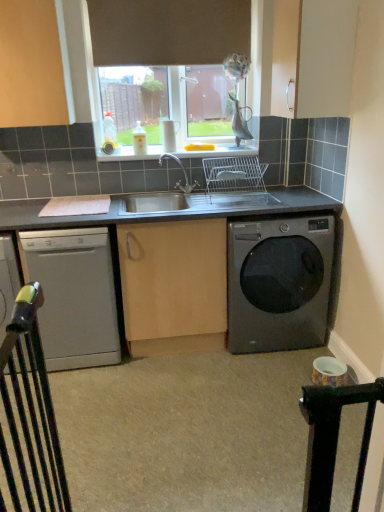
Question: Are satin silver dishwasher at lower left and metallic gray washing machine at lower right making contact?

Choices:
 (A) yes
 (B) no

Answer: (B)

Question: Considering the relative sizes of satin silver dishwasher at lower left and metallic gray washing machine at lower right in the image provided, is satin silver dishwasher at lower left thinner than metallic gray washing machine at lower right?

Choices:
 (A) yes
 (B) no

Answer: (A)

Question: Is satin silver dishwasher at lower left far from metallic gray washing machine at lower right?

Choices:
 (A) yes
 (B) no

Answer: (B)

Question: Can you confirm if satin silver dishwasher at lower left is bigger than metallic gray washing machine at lower right?

Choices:
 (A) yes
 (B) no

Answer: (B)

Question: From a real-world perspective, does satin silver dishwasher at lower left sit lower than metallic gray washing machine at lower right?

Choices:
 (A) no
 (B) yes

Answer: (A)

Question: Is satin silver dishwasher at lower left at the right side of metallic gray washing machine at lower right?

Choices:
 (A) no
 (B) yes

Answer: (A)

Question: From a real-world perspective, is stainless steel sink at center located higher than satin silver dishwasher at lower left?

Choices:
 (A) yes
 (B) no

Answer: (A)

Question: Is stainless steel sink at center bigger than satin silver dishwasher at lower left?

Choices:
 (A) no
 (B) yes

Answer: (A)

Question: Is stainless steel sink at center positioned with its back to satin silver dishwasher at lower left?

Choices:
 (A) no
 (B) yes

Answer: (A)

Question: Is stainless steel sink at center placed right next to satin silver dishwasher at lower left?

Choices:
 (A) no
 (B) yes

Answer: (A)

Question: Considering the relative positions of stainless steel sink at center and satin silver dishwasher at lower left in the image provided, is stainless steel sink at center to the left of satin silver dishwasher at lower left from the viewer's perspective?

Choices:
 (A) yes
 (B) no

Answer: (B)

Question: Is stainless steel sink at center smaller than satin silver dishwasher at lower left?

Choices:
 (A) no
 (B) yes

Answer: (B)

Question: From the image's perspective, is metallic gray washing machine at lower right on top of stainless steel sink at center?

Choices:
 (A) yes
 (B) no

Answer: (B)